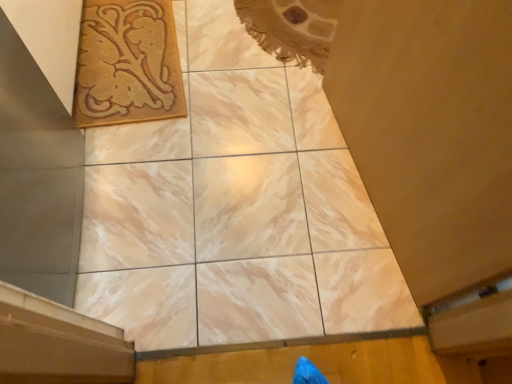
Locate an element on the screen. empty space that is in between beige woven rug at upper left and marble tile at center is located at coordinates (183, 130).